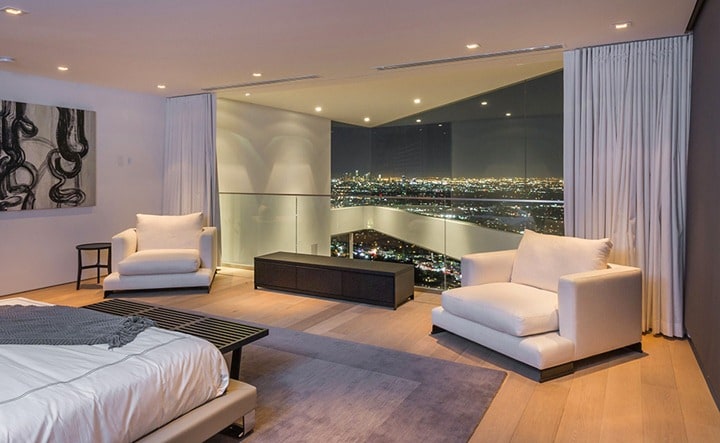
The height and width of the screenshot is (443, 720). Identify the location of frame. (201, 408).